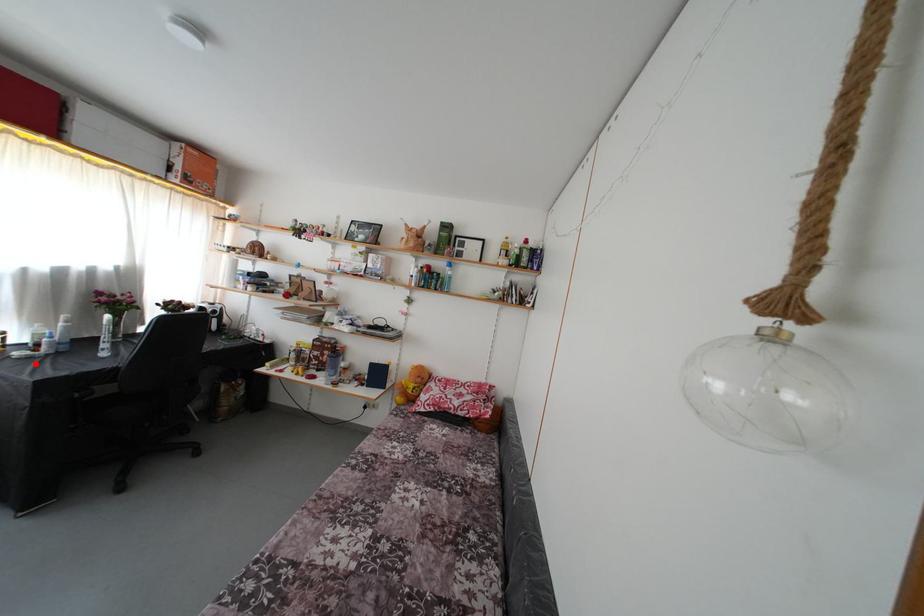
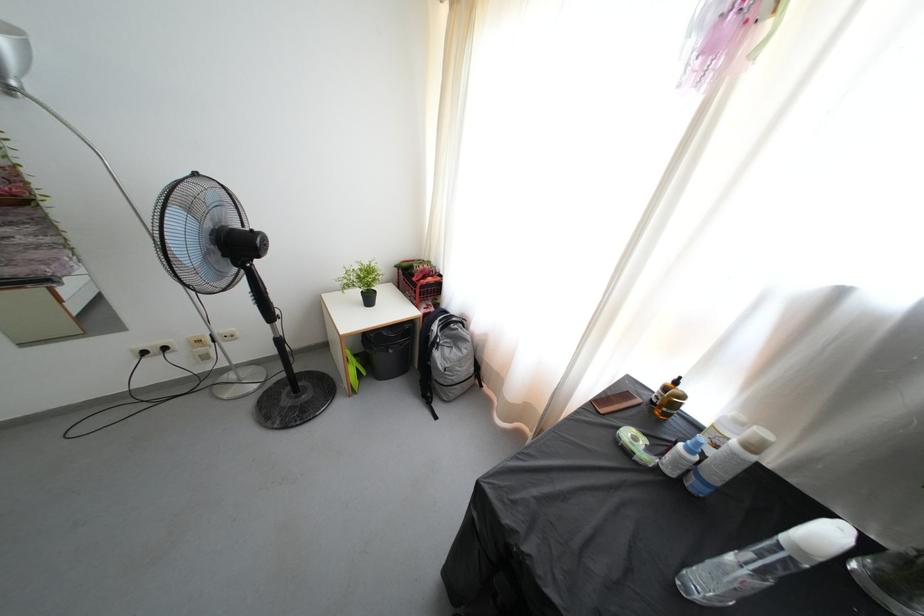
Question: I am providing you with two images of the same scene from different viewpoints. In image1, a red point is highlighted. Considering the same 3D point in image2, which of the following is correct?

Choices:
 (A) It is closer
 (B) It is farther

Answer: (B)